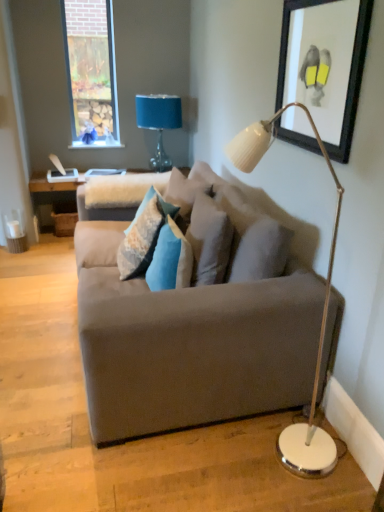
At what (x,y) coordinates should I click in order to perform the action: click on vacant space positioned to the left of white glossy floor lamp at right. Please return your answer as a coordinate pair (x, y). The image size is (384, 512). Looking at the image, I should click on (x=178, y=468).